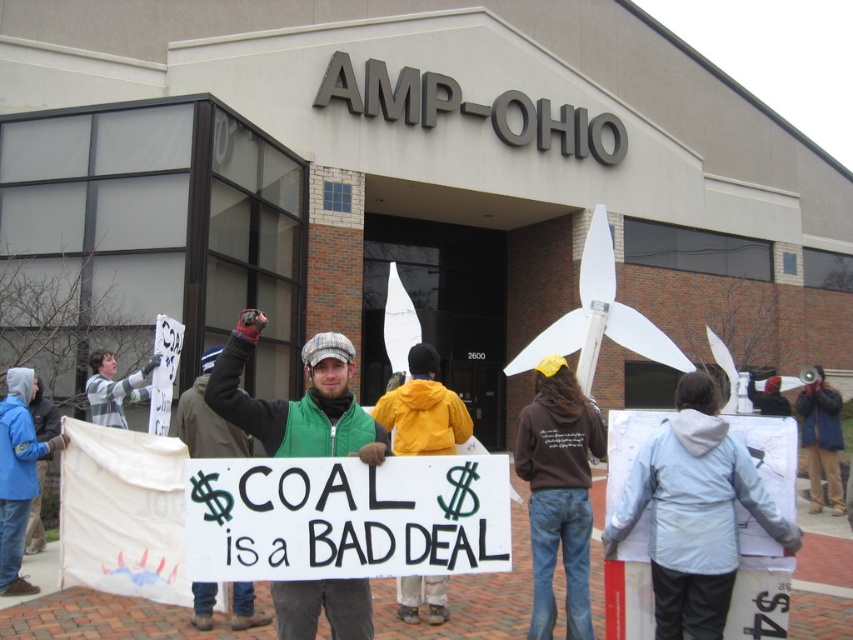
You are a photographer trying to capture both the blue fleece jacket at lower left and the green fabric jacket at center in a single shot. Based on their positions, which jacket should you focus on first to ensure both are in frame?

The blue fleece jacket at lower left is located below the green fabric jacket at center. To capture both in a single shot, focus on the green fabric jacket at center first, then adjust the camera angle to include the blue fleece jacket at lower left positioned below it.

Looking at this image, what object is located at the coordinate point [297,401] in the image?

The green fabric vest at center is located at the coordinate point [297,401].